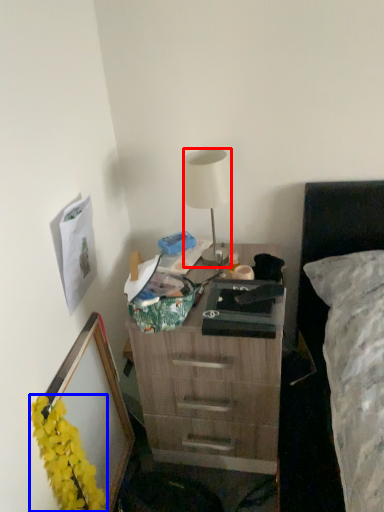
Question: Which point is further to the camera, lamp (highlighted by a red box) or flower (highlighted by a blue box)?

Choices:
 (A) lamp
 (B) flower

Answer: (A)